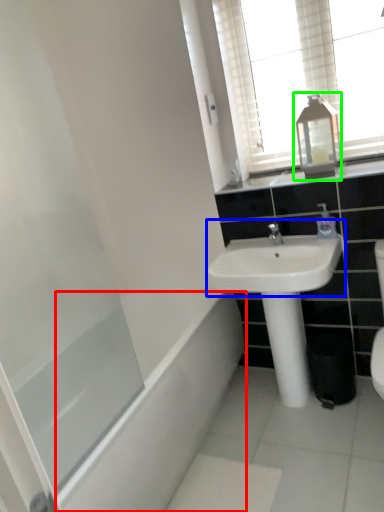
Question: Which object is positioned closest to bath (highlighted by a red box)? Select from sink (highlighted by a blue box) and medicine cabinet (highlighted by a green box).

Choices:
 (A) sink
 (B) medicine cabinet

Answer: (A)